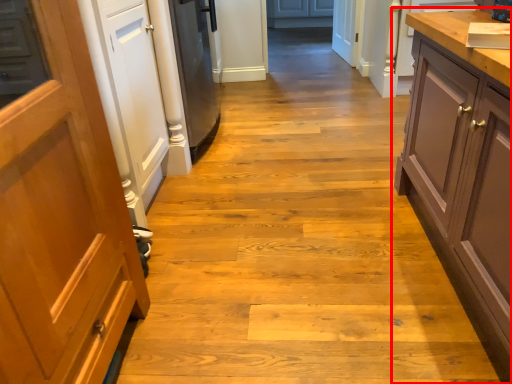
Question: Observing the image, what is the correct spatial positioning of cabinetry (annotated by the red box) in reference to countertop?

Choices:
 (A) left
 (B) right

Answer: (A)